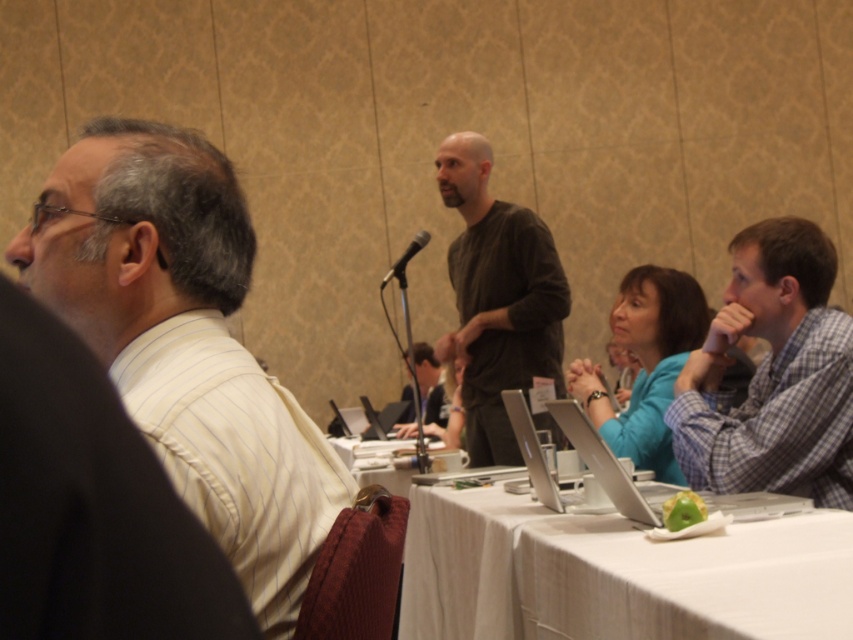
Question: Where is blue plaid shirt at right located in relation to dark brown cotton shirt at center in the image?

Choices:
 (A) above
 (B) below

Answer: (B)

Question: Does blue plaid shirt at right have a smaller size compared to black metallic microphone at center?

Choices:
 (A) no
 (B) yes

Answer: (A)

Question: Can you confirm if white striped shirt at left is smaller than blue plaid shirt at right?

Choices:
 (A) yes
 (B) no

Answer: (B)

Question: Which object is closer to the camera taking this photo?

Choices:
 (A) white striped shirt at left
 (B) blue plaid shirt at right
 (C) matte black laptop at center
 (D) white cloth table at lower center

Answer: (A)

Question: Among these points, which one is nearest to the camera?

Choices:
 (A) pyautogui.click(x=403, y=272)
 (B) pyautogui.click(x=712, y=401)

Answer: (B)

Question: Which point is closer to the camera?

Choices:
 (A) white striped shirt at left
 (B) silver metallic laptop at center

Answer: (A)